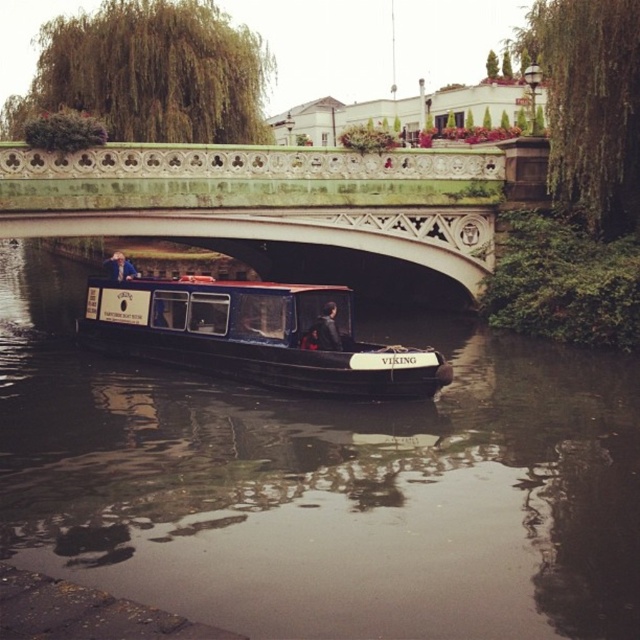
You are a tourist standing on the green stone bridge at upper center and want to take a photo of the black polished wood barge at center. Is the barge visible from your current position?

The green stone bridge at upper center is taller than the black polished wood barge at center, so yes, the barge is visible from your current position on the bridge.

You are standing on the green stone bridge at upper center and looking down at the dark brown water at center. Can you see the reflection of the bridge in the water?

The dark brown water at center is below green stone bridge at upper center. Since the water is calm and reflective, the reflection of the bridge would be visible in the water.